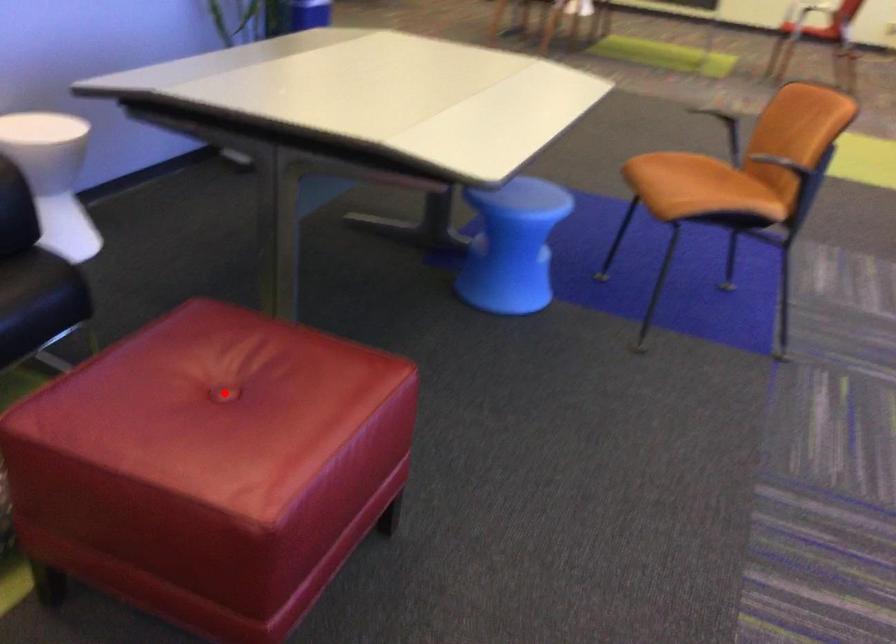
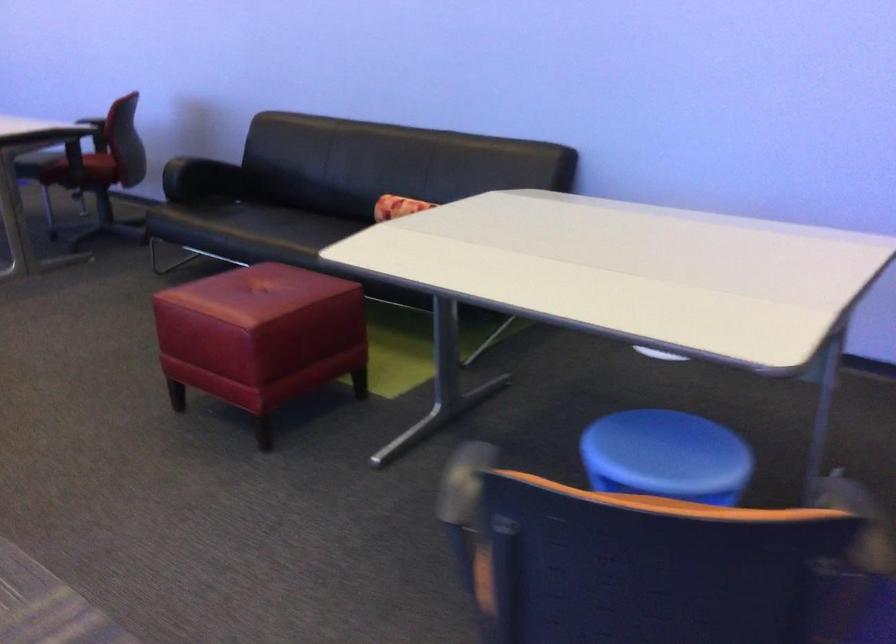
Question: A red point is marked in image1. In image2, is the corresponding 3D point closer to the camera or farther? Reply with the corresponding letter.

Choices:
 (A) The corresponding 3D point is closer.
 (B) The corresponding 3D point is farther.

Answer: (B)